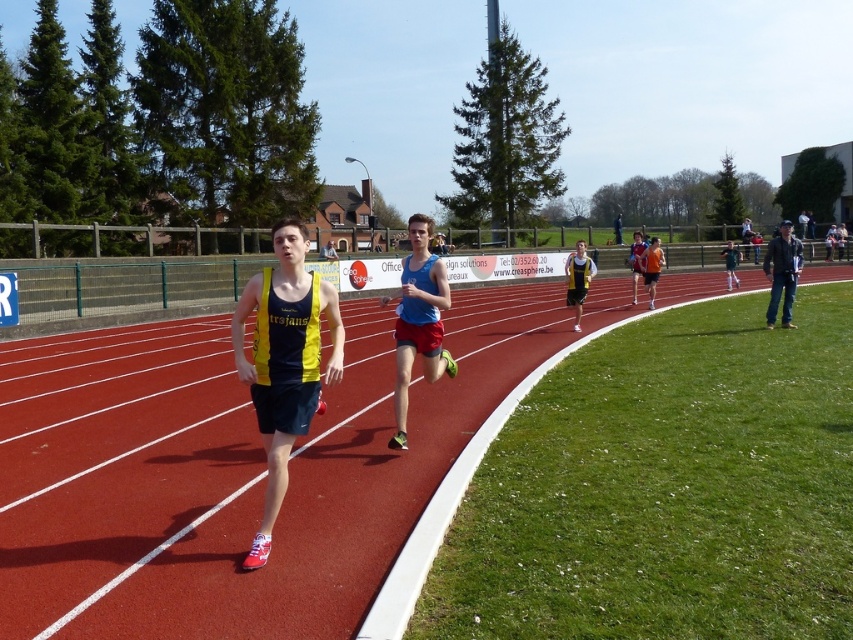
Question: Which object is closer to the camera taking this photo?

Choices:
 (A) matte yellow tank top at center
 (B) rubberized red track at center
 (C) green matte shorts at center
 (D) yellow and blue athletic top at center

Answer: (B)

Question: Observing the image, what is the correct spatial positioning of rubberized red track at center in reference to dark blue leather jacket at right?

Choices:
 (A) left
 (B) right

Answer: (A)

Question: Is dark blue leather jacket at right closer to camera compared to matte yellow tank top at center?

Choices:
 (A) yes
 (B) no

Answer: (A)

Question: Is dark blue leather jacket at right smaller than green matte shorts at center?

Choices:
 (A) no
 (B) yes

Answer: (B)

Question: Which point is farther to the camera?

Choices:
 (A) (x=737, y=253)
 (B) (x=786, y=252)
 (C) (x=587, y=262)
 (D) (x=254, y=392)

Answer: (A)

Question: Which is farther from the dark blue leather jacket at right?

Choices:
 (A) blue fabric tank top at center
 (B) yellow and blue athletic top at center

Answer: (B)